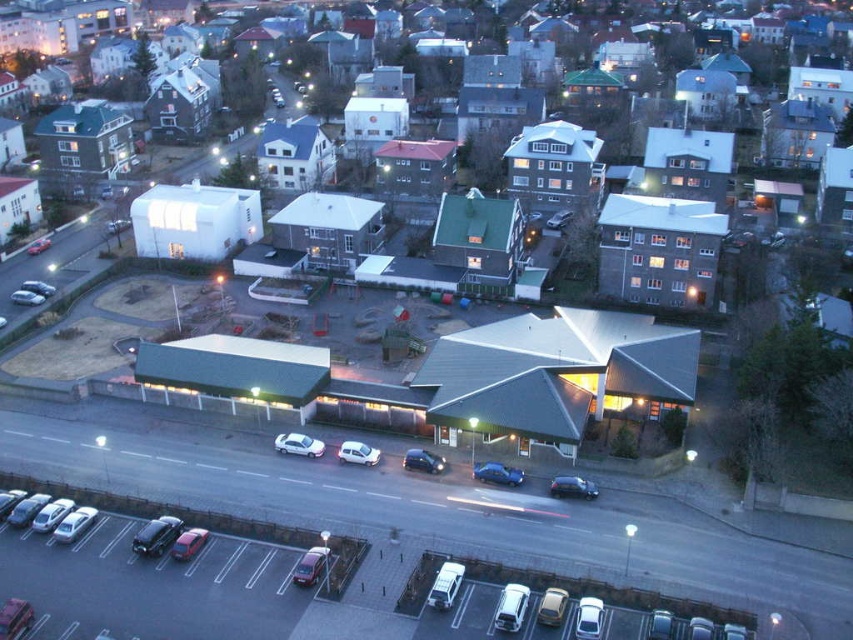
I want to click on metallic silver cars at lower left, so click(448, 516).

Who is shorter, metallic silver cars at lower left or silver metallic car at center?

silver metallic car at center is shorter.

At what (x,y) coordinates should I click in order to perform the action: click on metallic silver cars at lower left. Please return your answer as a coordinate pair (x, y). Looking at the image, I should click on (448, 516).

You are a GUI agent. You are given a task and a screenshot of the screen. Output one action in this format:
    pyautogui.click(x=<x>, y=<y>)
    Task: Click on the metallic silver cars at lower left
    
    Given the screenshot: What is the action you would take?
    pyautogui.click(x=448, y=516)

Is point (498, 467) positioned behind point (422, 464)?

No, it is in front of (422, 464).

Between shiny blue sedan at center and shiny silver car at center, which one is positioned lower?

Positioned lower is shiny blue sedan at center.

The height and width of the screenshot is (640, 853). Describe the element at coordinates (498, 474) in the screenshot. I see `shiny blue sedan at center` at that location.

Where is `shiny blue sedan at center`? The height and width of the screenshot is (640, 853). shiny blue sedan at center is located at coordinates (498, 474).

Does metallic silver cars at lower left have a greater height compared to shiny blue sedan at center?

Correct, metallic silver cars at lower left is much taller as shiny blue sedan at center.

Where is `metallic silver cars at lower left`? metallic silver cars at lower left is located at coordinates (448, 516).